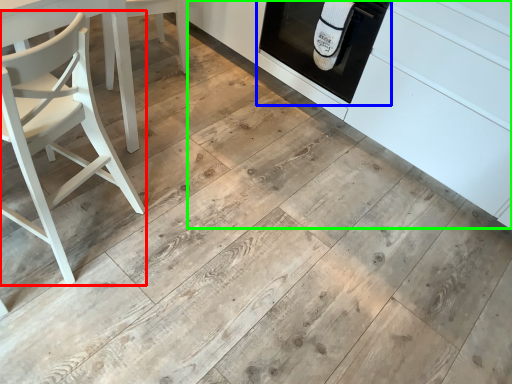
Question: Estimate the real-world distances between objects in this image. Which object is farther from chair (highlighted by a red box), oven (highlighted by a blue box) or cabinetry (highlighted by a green box)?

Choices:
 (A) oven
 (B) cabinetry

Answer: (B)